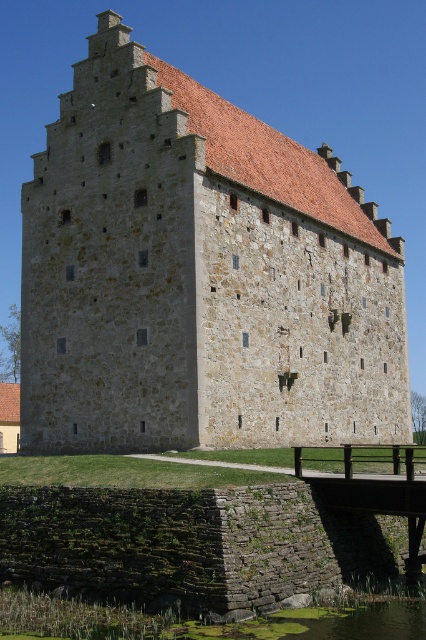
You are a visitor approaching the stone brick castle at center from the front entrance. As you walk towards the castle, will the green mossy water at lower center become visible or hidden behind the castle?

The green mossy water at lower center is behind the stone brick castle at center, so as you approach the castle from the front entrance, the green mossy water at lower center will become hidden behind the castle.

You are a visitor standing at the entrance of the stone brick castle at center. You notice the green mossy water at lower center nearby. Can you determine if the castle is wider than the water area?

The stone brick castle at center might be wider than green mossy water at lower center according to the description.